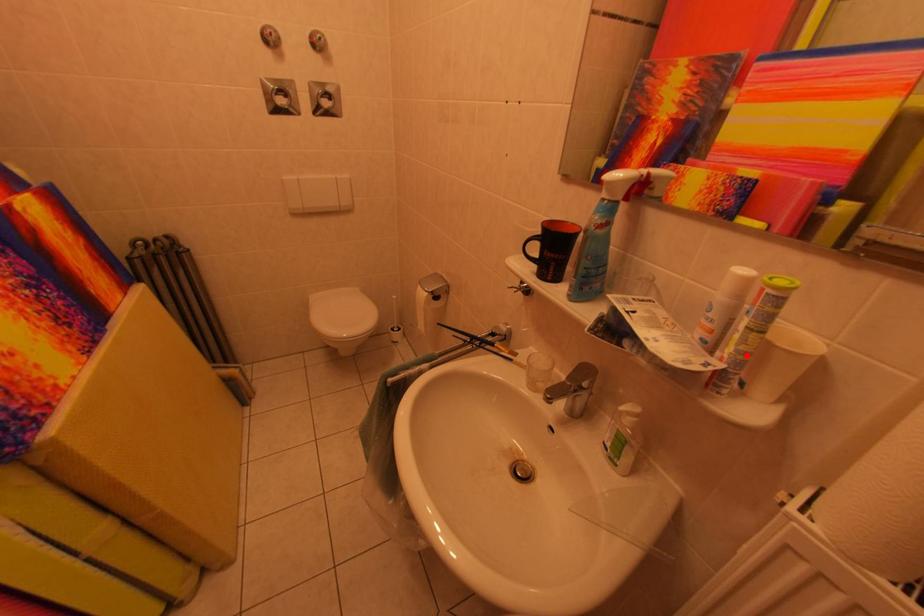
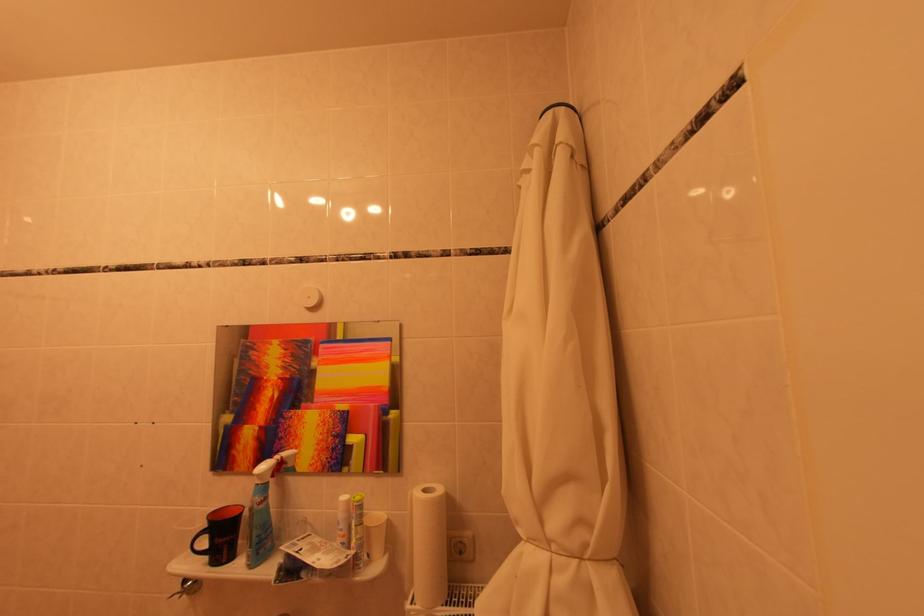
In the second image, find the point that corresponds to the highlighted location in the first image.

(365, 544)